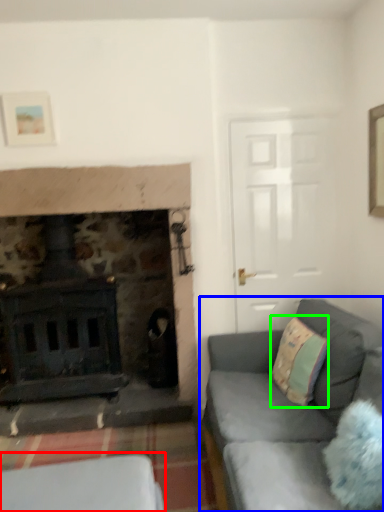
Question: Which object is the farthest from furniture (highlighted by a red box)? Choose among these: studio couch (highlighted by a blue box) or throw pillow (highlighted by a green box).

Choices:
 (A) studio couch
 (B) throw pillow

Answer: (B)